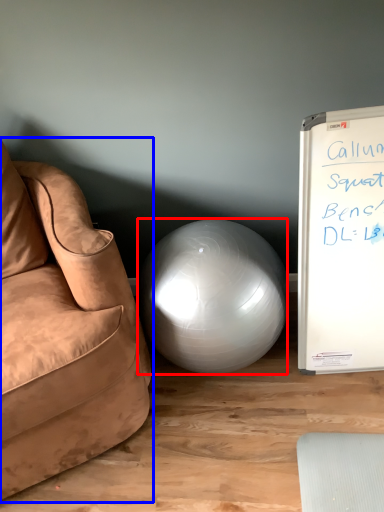
Question: Which object is further to the camera taking this photo, ball (highlighted by a red box) or studio couch (highlighted by a blue box)?

Choices:
 (A) ball
 (B) studio couch

Answer: (A)